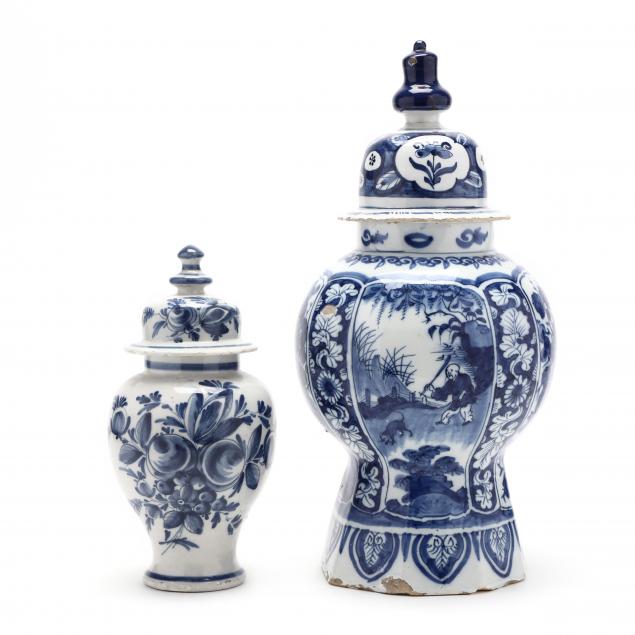
You are a GUI agent. You are given a task and a screenshot of the screen. Output one action in this format:
    pyautogui.click(x=<x>, y=<y>)
    Task: Click on the vase
    
    Given the screenshot: What is the action you would take?
    pyautogui.click(x=204, y=566)